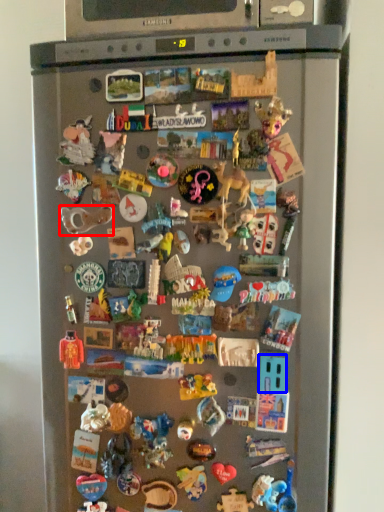
Question: Which of the following is the farthest to the observer, toy (highlighted by a red box) or toy (highlighted by a blue box)?

Choices:
 (A) toy
 (B) toy

Answer: (A)